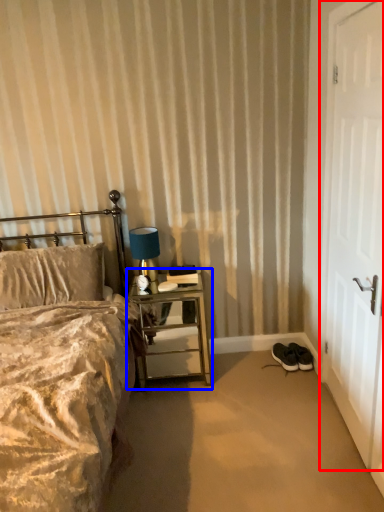
Question: Among these objects, which one is farthest to the camera, door (highlighted by a red box) or nightstand (highlighted by a blue box)?

Choices:
 (A) door
 (B) nightstand

Answer: (B)